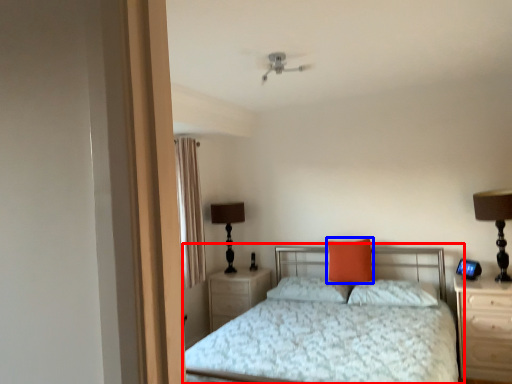
Question: Which object is further to the camera taking this photo, bed (highlighted by a red box) or pillow (highlighted by a blue box)?

Choices:
 (A) bed
 (B) pillow

Answer: (B)